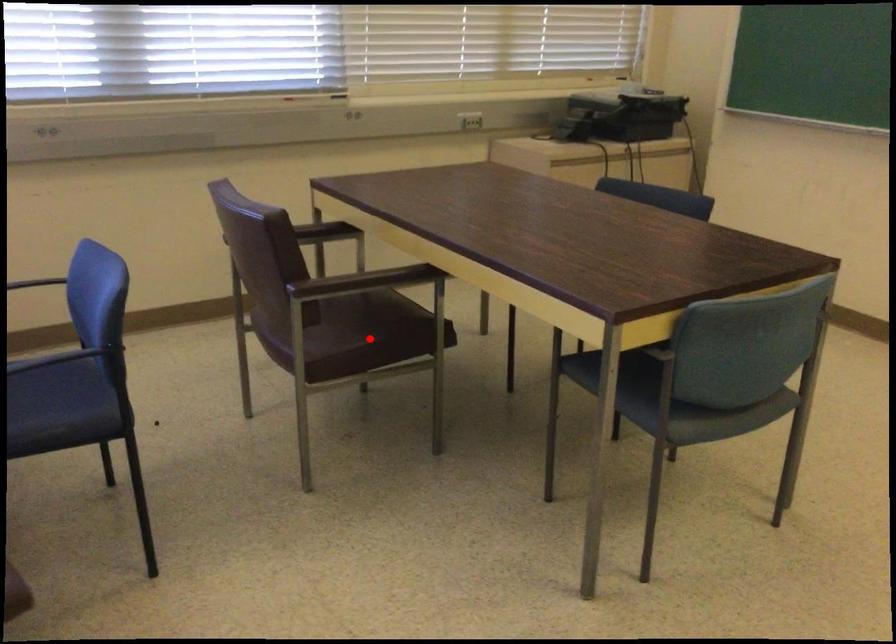
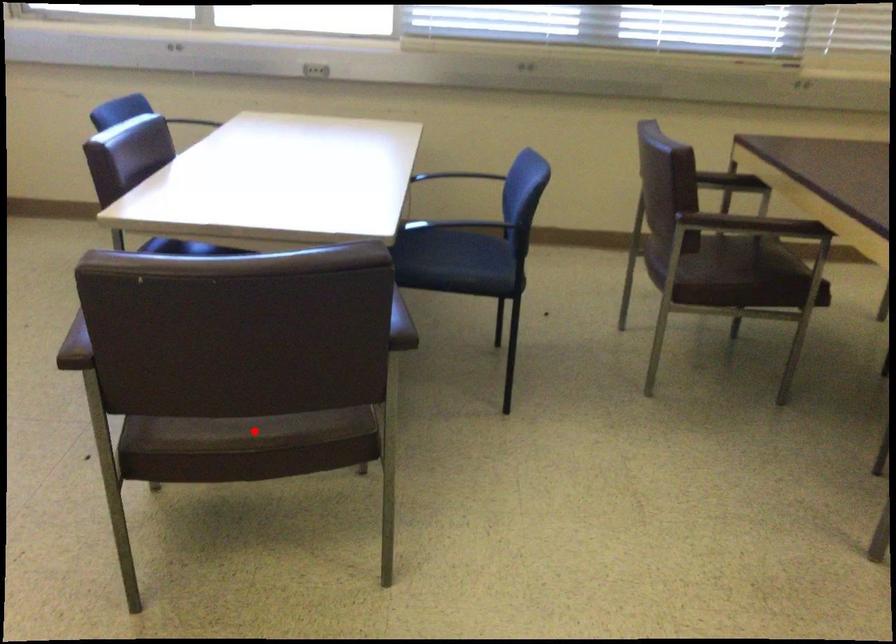
I am providing you with two images of the same scene from different viewpoints. A red point is marked on the first image and another point is marked on the second image. Is the marked point in image1 the same physical position as the marked point in image2?

No